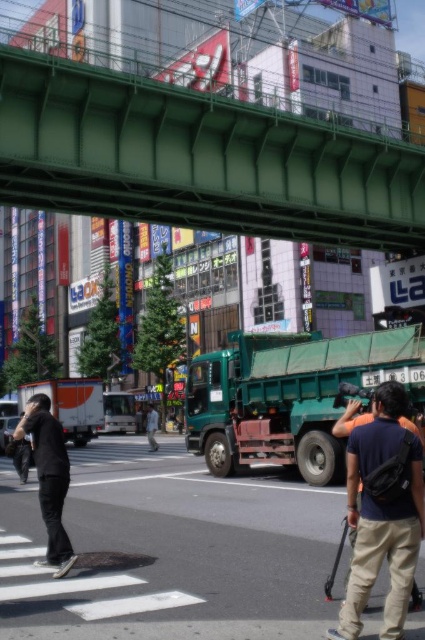
Can you confirm if metallic truck at center is smaller than dark blue shirt at right?

Actually, metallic truck at center might be larger than dark blue shirt at right.

Does metallic truck at center have a greater height compared to dark blue shirt at right?

Yes.

Is point (419, 580) closer to camera compared to point (419, 442)?

No, (419, 580) is further to viewer.

The height and width of the screenshot is (640, 425). Identify the location of metallic truck at center. (170, 550).

Can you confirm if green metallic bridge at upper center is shorter than dark blue shirt at right?

Incorrect, green metallic bridge at upper center's height does not fall short of dark blue shirt at right's.

Measure the distance between green metallic bridge at upper center and camera.

green metallic bridge at upper center is 18.80 meters from camera.

Where is `green metallic bridge at upper center`? green metallic bridge at upper center is located at coordinates (198, 157).

Who is more forward, (243, 625) or (365, 236)?

Point (243, 625)

Who is positioned more to the left, metallic truck at center or green metallic bridge at upper center?

Positioned to the left is metallic truck at center.

Identify the location of metallic truck at center. The height and width of the screenshot is (640, 425). (170, 550).